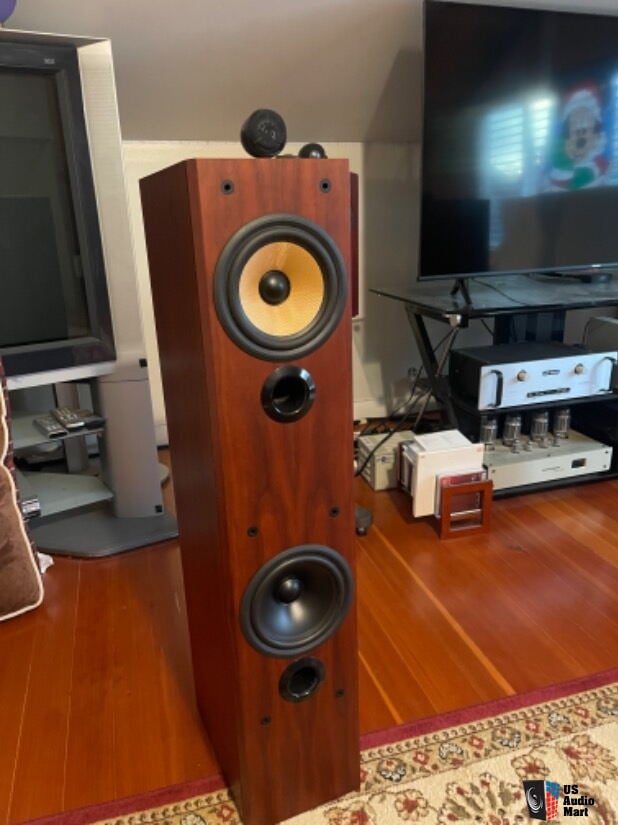
Identify the location of stereo equipment. (x=513, y=373), (x=535, y=472), (x=441, y=481), (x=386, y=469).